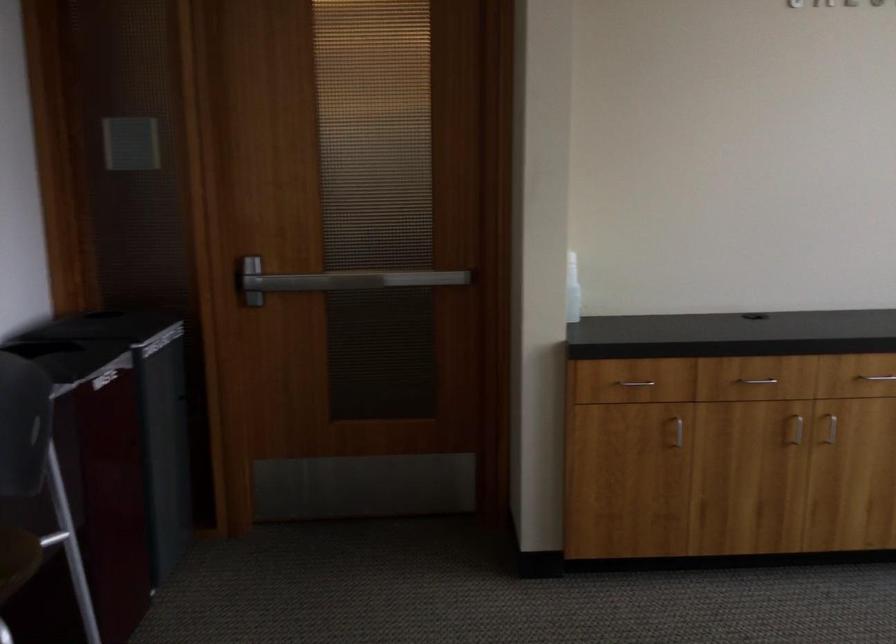
Where would you lift the white dispenser bottle? Please return your answer as a coordinate pair (x, y).

(572, 289)